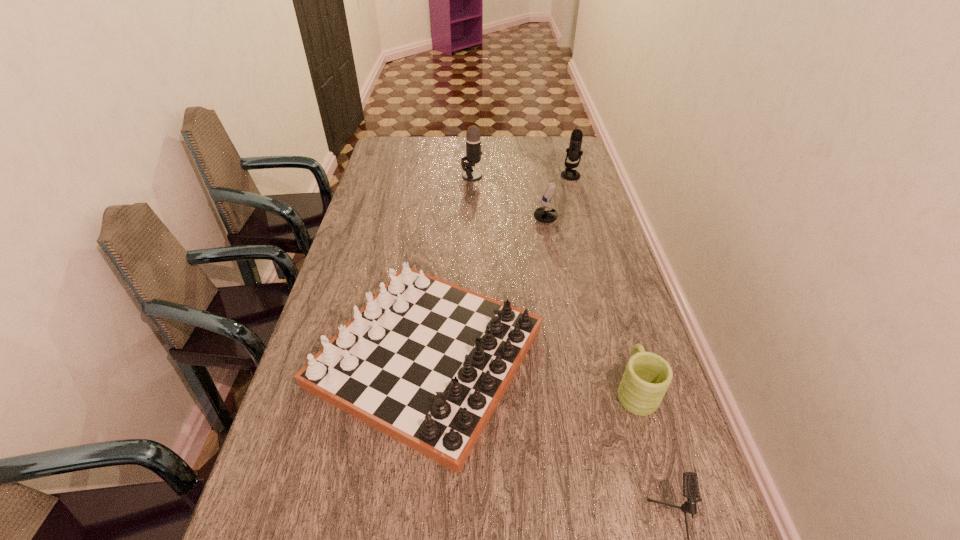
The image size is (960, 540). In order to click on vacant space in between the mug and the gameboard in this screenshot , I will do `click(531, 374)`.

Where is `free spot between the fourth nearest object and the leftmost microphone`? The height and width of the screenshot is (540, 960). free spot between the fourth nearest object and the leftmost microphone is located at coordinates (516, 198).

I want to click on free space that is in between the third farthest object and the gameboard, so click(x=494, y=289).

This screenshot has width=960, height=540. Identify the location of object that is the fourth nearest to the gameboard. (473, 136).

Locate which object is the second closest to the leftmost microphone. Please provide its 2D coordinates. Your answer should be formatted as a tuple, i.e. [(x, y)], where the tuple contains the x and y coordinates of a point satisfying the conditions above.

[(574, 152)]

Find the location of a particular element. The image size is (960, 540). the fourth closest microphone relative to the gameboard is located at coordinates (574, 152).

Find the location of `microphone that is the closest to the gameboard`. microphone that is the closest to the gameboard is located at coordinates (690, 479).